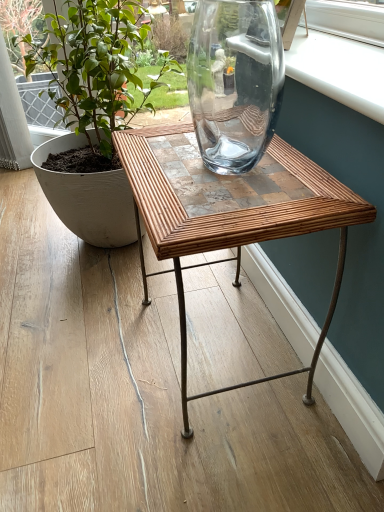
Question: In terms of width, does green matte plant at left look wider or thinner when compared to bamboowoodentable at center?

Choices:
 (A) thin
 (B) wide

Answer: (B)

Question: Is green matte plant at left taller or shorter than bamboowoodentable at center?

Choices:
 (A) tall
 (B) short

Answer: (A)

Question: Based on their sizes in the image, would you say green matte plant at left is bigger or smaller than bamboowoodentable at center?

Choices:
 (A) small
 (B) big

Answer: (B)

Question: From the image's perspective, relative to green matte plant at left, is bamboowoodentable at center above or below?

Choices:
 (A) above
 (B) below

Answer: (B)

Question: Considering the positions of bamboowoodentable at center and green matte plant at left in the image, is bamboowoodentable at center bigger or smaller than green matte plant at left?

Choices:
 (A) small
 (B) big

Answer: (A)

Question: From their relative heights in the image, would you say bamboowoodentable at center is taller or shorter than green matte plant at left?

Choices:
 (A) tall
 (B) short

Answer: (B)

Question: Looking at their shapes, would you say bamboowoodentable at center is wider or thinner than green matte plant at left?

Choices:
 (A) thin
 (B) wide

Answer: (A)